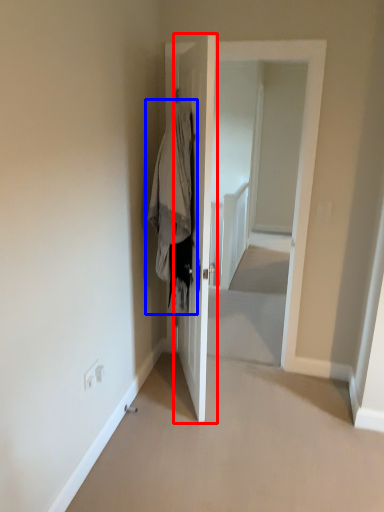
Question: Among these objects, which one is farthest to the camera, door (highlighted by a red box) or clothing (highlighted by a blue box)?

Choices:
 (A) door
 (B) clothing

Answer: (B)